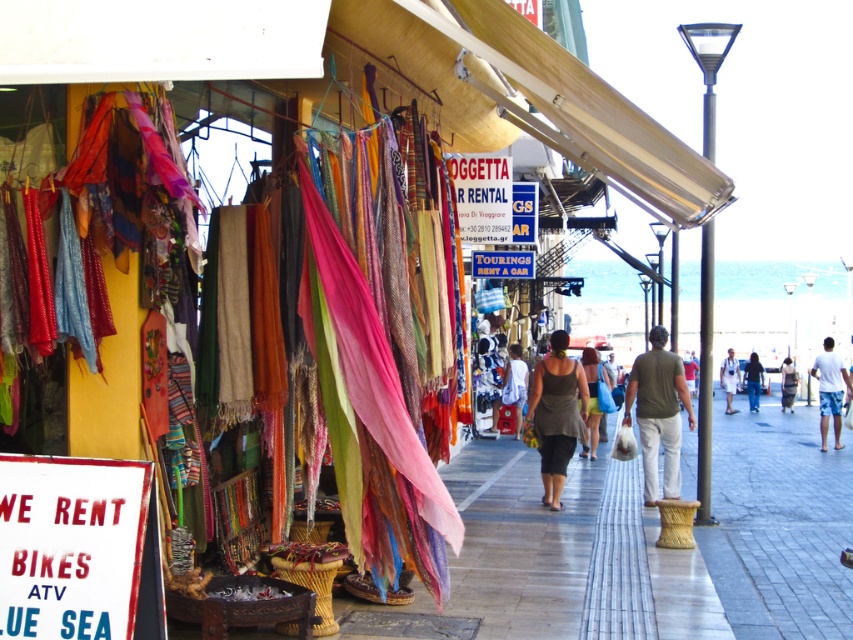
Question: Does white cotton shorts at right appear on the left side of dark gray fabric bag at center?

Choices:
 (A) no
 (B) yes

Answer: (B)

Question: Which object is farther from the camera taking this photo?

Choices:
 (A) matte green dress at center
 (B) dark gray fabric skirt at center

Answer: (A)

Question: Considering the real-world distances, which object is farthest from the white cotton shorts at right?

Choices:
 (A) white cotton shorts at center
 (B) white cotton shirt at center
 (C) dark gray fabric skirt at center
 (D) matte green dress at center

Answer: (C)

Question: In this image, where is white cotton shorts at right located relative to white cotton shirt at center?

Choices:
 (A) left
 (B) right

Answer: (B)

Question: Which point is farther to the camera?

Choices:
 (A) white cotton shirt at center
 (B) denim jeans at center
 (C) dark gray fabric skirt at center

Answer: (B)

Question: Is dark gray fabric skirt at center below white cotton shorts at center?

Choices:
 (A) no
 (B) yes

Answer: (A)